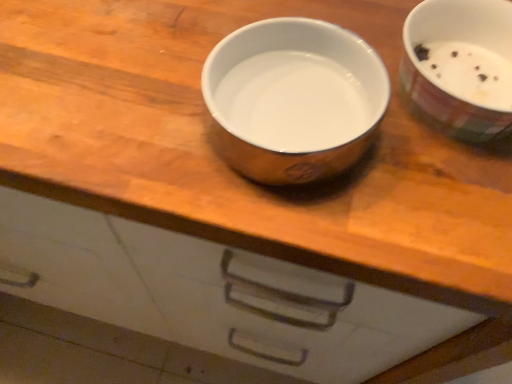
Question: From a real-world perspective, is satin silver bowl at center, marked as the 1th tableware in a left-to-right arrangement, below white glossy bowl at upper right, which appears as the first tableware when viewed from the right?

Choices:
 (A) yes
 (B) no

Answer: (A)

Question: Is satin silver bowl at center, marked as the 1th tableware in a left-to-right arrangement, wider than white glossy bowl at upper right, the 2th tableware from the left?

Choices:
 (A) no
 (B) yes

Answer: (A)

Question: Is the depth of satin silver bowl at center, which is the 2th tableware in right-to-left order, greater than that of white glossy bowl at upper right, the 2th tableware from the left?

Choices:
 (A) yes
 (B) no

Answer: (B)

Question: From the image's perspective, is satin silver bowl at center, marked as the 1th tableware in a left-to-right arrangement, above white glossy bowl at upper right, the 2th tableware from the left?

Choices:
 (A) no
 (B) yes

Answer: (A)

Question: Is satin silver bowl at center, which is the 2th tableware in right-to-left order, shorter than white glossy bowl at upper right, the 2th tableware from the left?

Choices:
 (A) no
 (B) yes

Answer: (B)

Question: Is satin silver bowl at center, which is the 2th tableware in right-to-left order, bigger than white glossy bowl at upper right, the 2th tableware from the left?

Choices:
 (A) no
 (B) yes

Answer: (A)

Question: Does white glossy bowl at upper right, the 2th tableware from the left, have a lesser height compared to satin silver bowl at center, which is the 2th tableware in right-to-left order?

Choices:
 (A) yes
 (B) no

Answer: (B)

Question: Is white glossy bowl at upper right, which appears as the first tableware when viewed from the right, oriented towards satin silver bowl at center, which is the 2th tableware in right-to-left order?

Choices:
 (A) no
 (B) yes

Answer: (A)

Question: Is white glossy bowl at upper right, which appears as the first tableware when viewed from the right, in front of satin silver bowl at center, marked as the 1th tableware in a left-to-right arrangement?

Choices:
 (A) yes
 (B) no

Answer: (B)

Question: Considering the relative positions of white glossy bowl at upper right, the 2th tableware from the left, and satin silver bowl at center, which is the 2th tableware in right-to-left order, in the image provided, is white glossy bowl at upper right, the 2th tableware from the left, to the left of satin silver bowl at center, which is the 2th tableware in right-to-left order, from the viewer's perspective?

Choices:
 (A) yes
 (B) no

Answer: (B)

Question: From a real-world perspective, does white glossy bowl at upper right, the 2th tableware from the left, stand above satin silver bowl at center, which is the 2th tableware in right-to-left order?

Choices:
 (A) no
 (B) yes

Answer: (B)

Question: From the image's perspective, is white glossy bowl at upper right, the 2th tableware from the left, located above satin silver bowl at center, which is the 2th tableware in right-to-left order?

Choices:
 (A) no
 (B) yes

Answer: (B)

Question: From a real-world perspective, relative to white glossy bowl at upper right, which appears as the first tableware when viewed from the right, is satin silver bowl at center, which is the 2th tableware in right-to-left order, vertically above or below?

Choices:
 (A) above
 (B) below

Answer: (B)